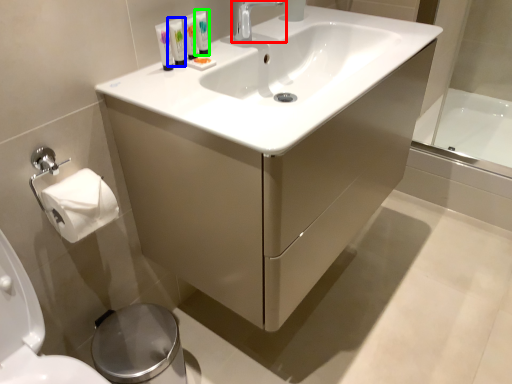
Question: Which is nearer to the tap (highlighted by a red box)? mouthwash (highlighted by a blue box) or mouthwash (highlighted by a green box).

Choices:
 (A) mouthwash
 (B) mouthwash

Answer: (B)